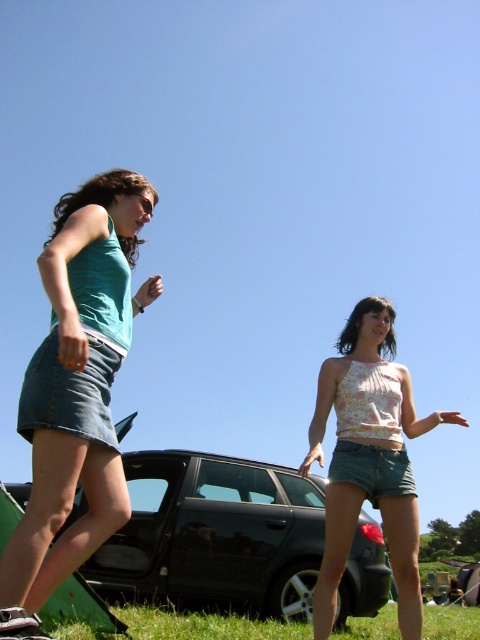
Question: Can you confirm if matte denim skirt at left is positioned below green grass at lower center?

Choices:
 (A) yes
 (B) no

Answer: (B)

Question: Does black metallic car at center come behind green grass at lower center?

Choices:
 (A) yes
 (B) no

Answer: (A)

Question: Estimate the real-world distances between objects in this image. Which object is farther from the floral fabric top at center?

Choices:
 (A) black metallic car at center
 (B) green grass at lower center
 (C) matte denim skirt at left

Answer: (B)

Question: Is floral fabric top at center below green grass at lower center?

Choices:
 (A) no
 (B) yes

Answer: (A)

Question: Among these points, which one is farthest from the camera?

Choices:
 (A) (276, 627)
 (B) (48, 474)
 (C) (396, 406)

Answer: (A)

Question: Based on their relative distances, which object is farther from the floral fabric top at center?

Choices:
 (A) matte denim skirt at left
 (B) green grass at lower center

Answer: (B)